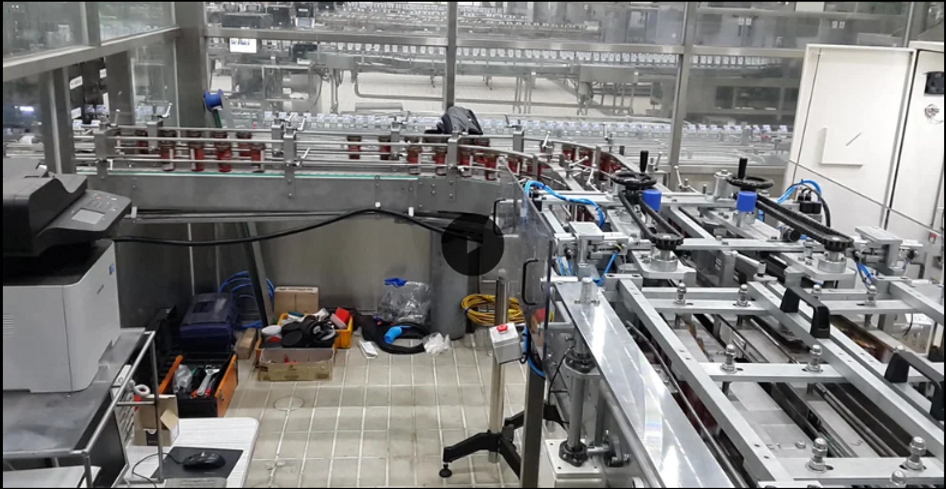
Locate an element on the screen. computer mouse is located at coordinates (200, 457).